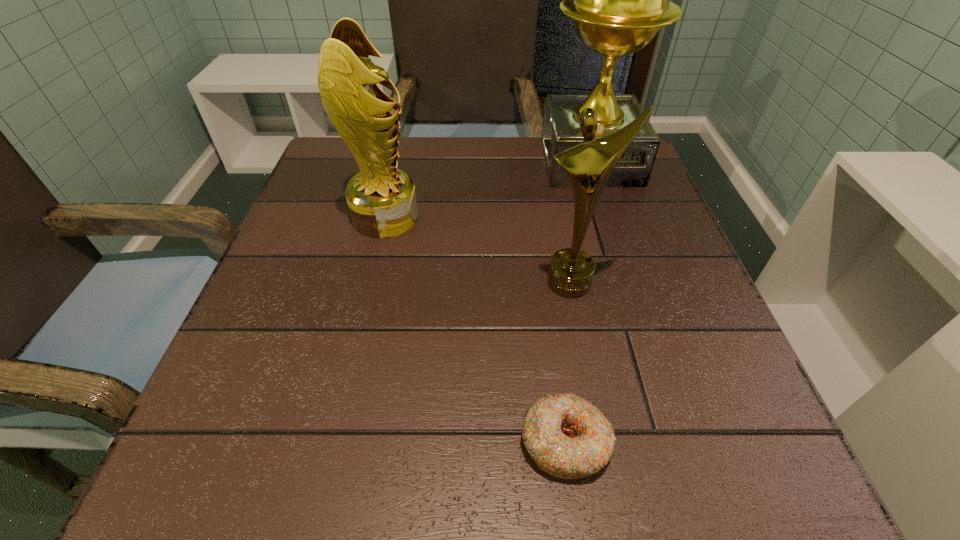
What are the coordinates of `the farthest object` in the screenshot? It's located at (619, 0).

Identify the location of the leftmost award. The height and width of the screenshot is (540, 960). (382, 202).

Find the location of a particular element. This screenshot has height=540, width=960. the leftmost object is located at coordinates (382, 202).

Locate an element on the screen. the third farthest object is located at coordinates (588, 165).

The image size is (960, 540). I want to click on the shortest object, so click(x=567, y=436).

Image resolution: width=960 pixels, height=540 pixels. I want to click on doughnut, so click(567, 436).

Identify the location of free space located 0.200m on the front-facing side of the farthest award. [458, 161].

Locate an element on the screen. The width and height of the screenshot is (960, 540). vacant space located on the front-facing side of the farthest award is located at coordinates (470, 161).

At what (x,y) coordinates should I click in order to perform the action: click on vacant space located 0.220m on the front-facing side of the farthest award. Please return your answer as a coordinate pair (x, y). The width and height of the screenshot is (960, 540). Looking at the image, I should click on click(x=449, y=161).

Where is `blank area located on the front-facing side of the second nearest award`? The image size is (960, 540). blank area located on the front-facing side of the second nearest award is located at coordinates (590, 218).